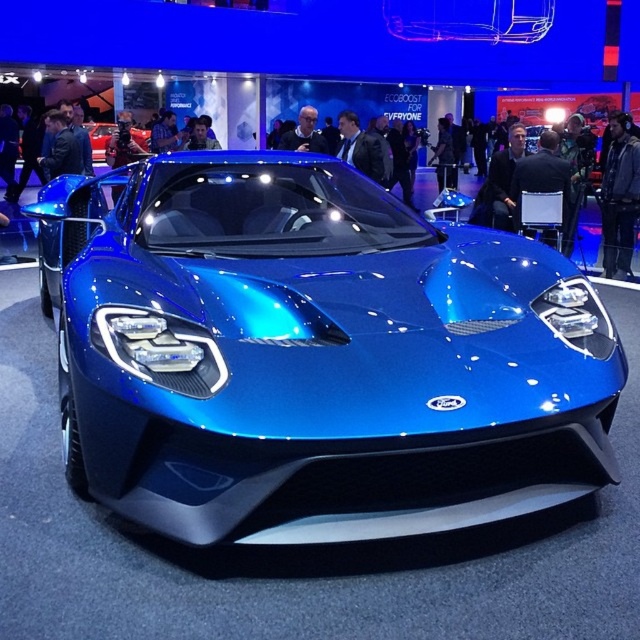
You are standing in front of the blue Ford GT sports car at the exhibition. You notice two points marked on the car. The first point is at coordinate point (93,308) and the second point is at coordinate point (90,124). Which of these two points is closer to your viewpoint?

Point (93,308) is closer to the camera than point (90,124).